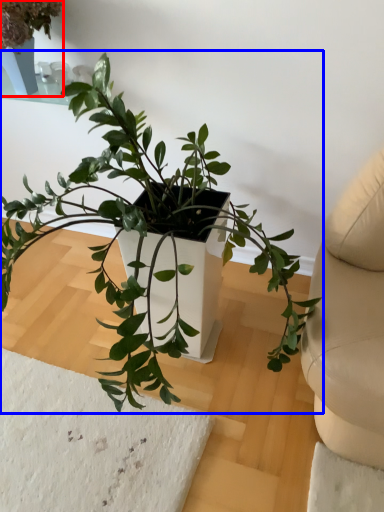
Question: Among these objects, which one is nearest to the camera, houseplant (highlighted by a red box) or houseplant (highlighted by a blue box)?

Choices:
 (A) houseplant
 (B) houseplant

Answer: (B)